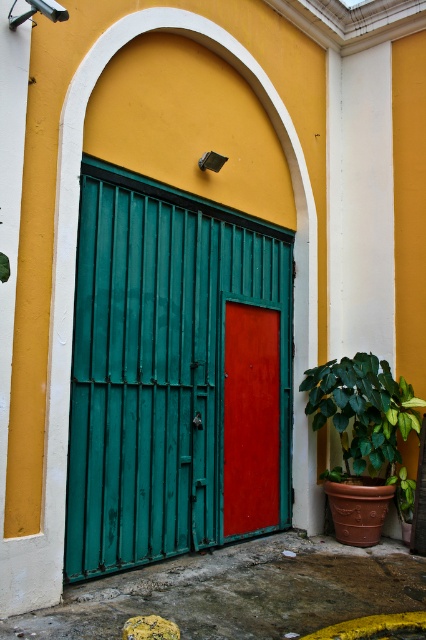
You are standing in front of the large arched doorway with the teal green metal bars on the left and the red door on the right. There is a point marked at coordinates (175, 374). Based on the scene description, which object does this point correspond to?

The point at coordinates (175, 374) corresponds to the green metal glass door at center.